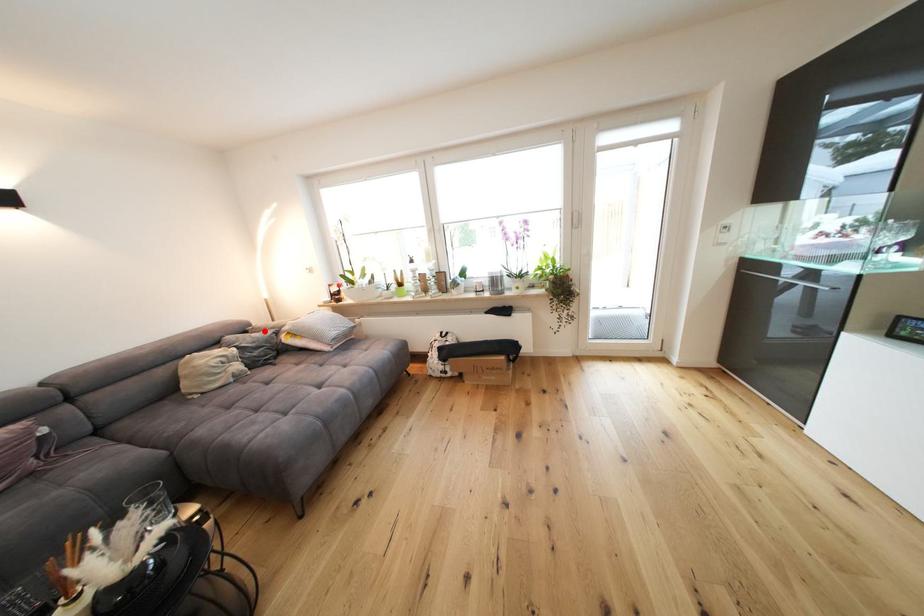
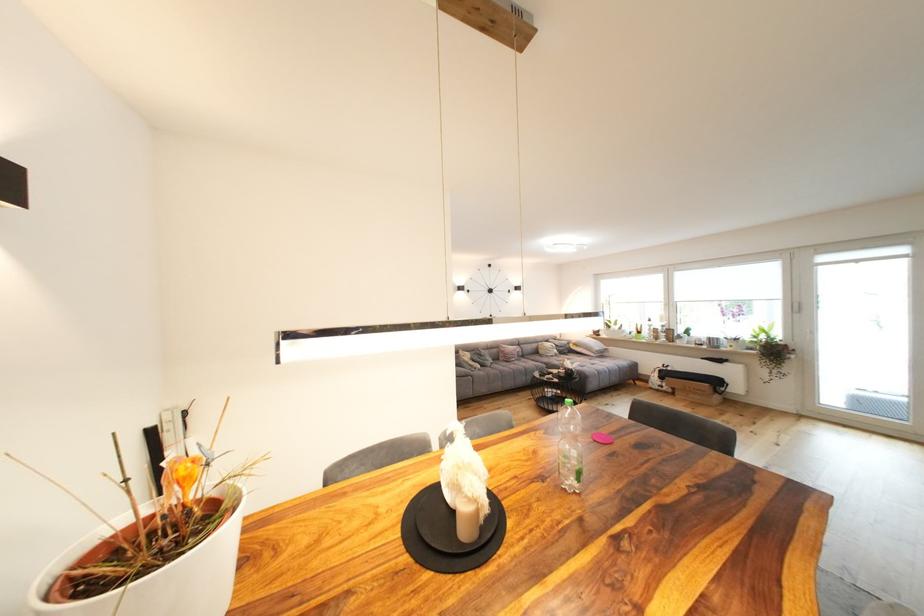
Find the pixel in the second image that matches the highlighted location in the first image.

(566, 342)